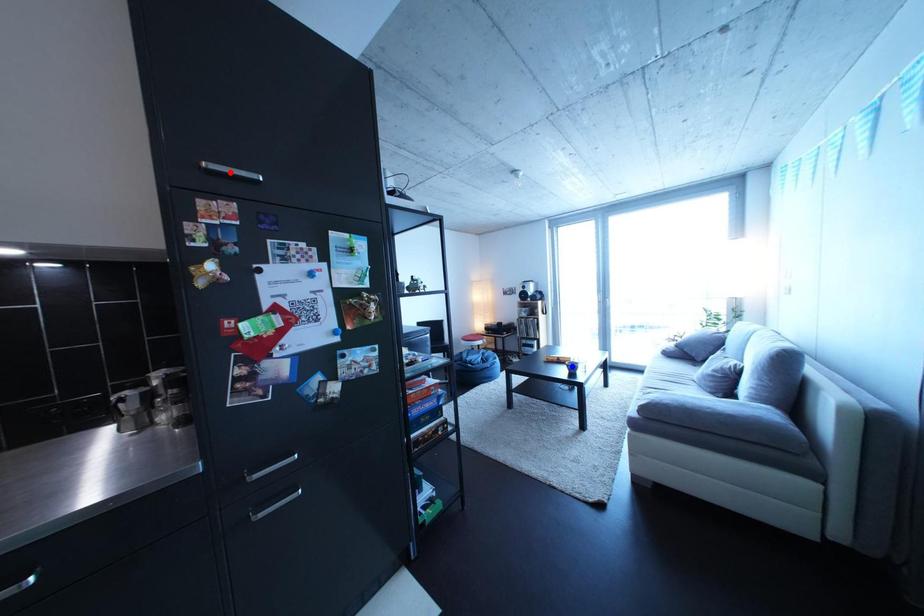
Question: Two points are marked on the image. Which point is closer to the camera?

Choices:
 (A) Blue point is closer.
 (B) Red point is closer.

Answer: (B)